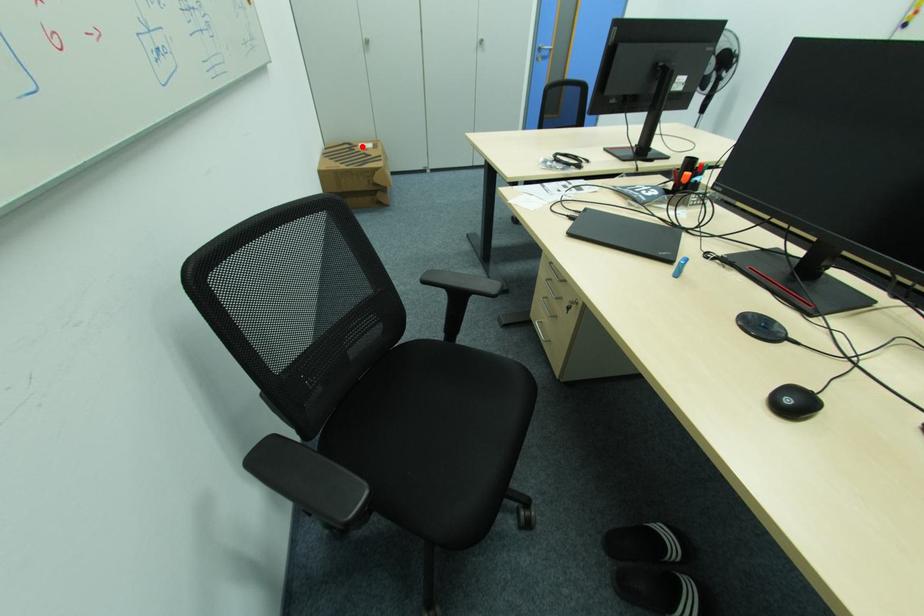
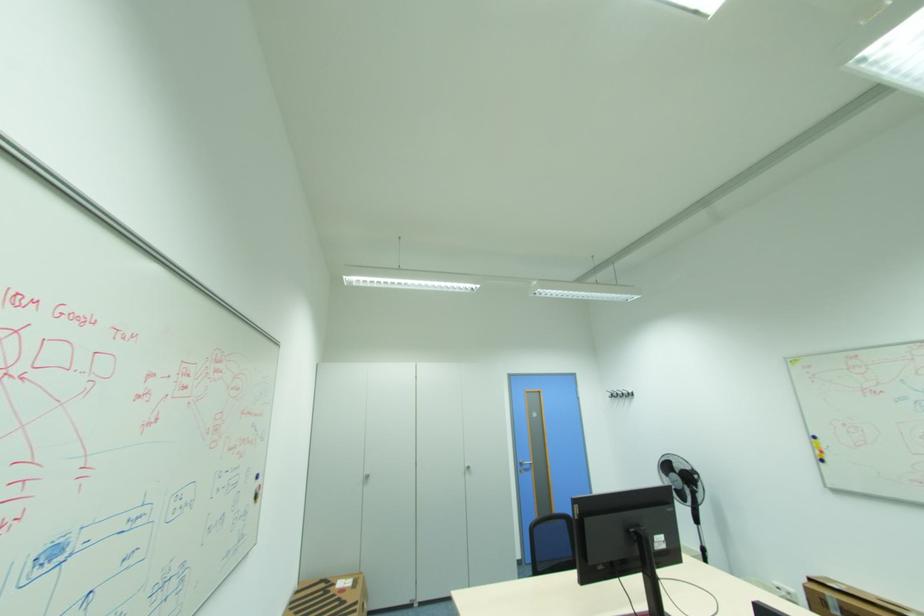
Where in the second image is the point corresponding to the highlighted location from the first image?

(338, 585)